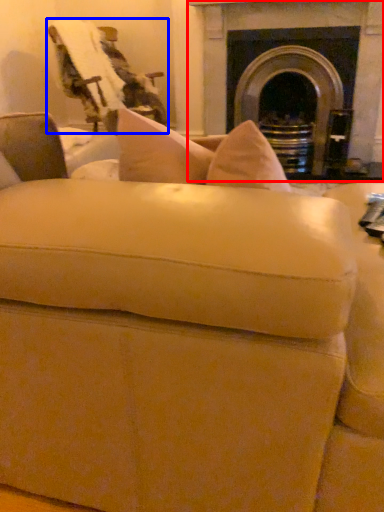
Question: Which point is closer to the camera, fireplace (highlighted by a red box) or swivel chair (highlighted by a blue box)?

Choices:
 (A) fireplace
 (B) swivel chair

Answer: (B)